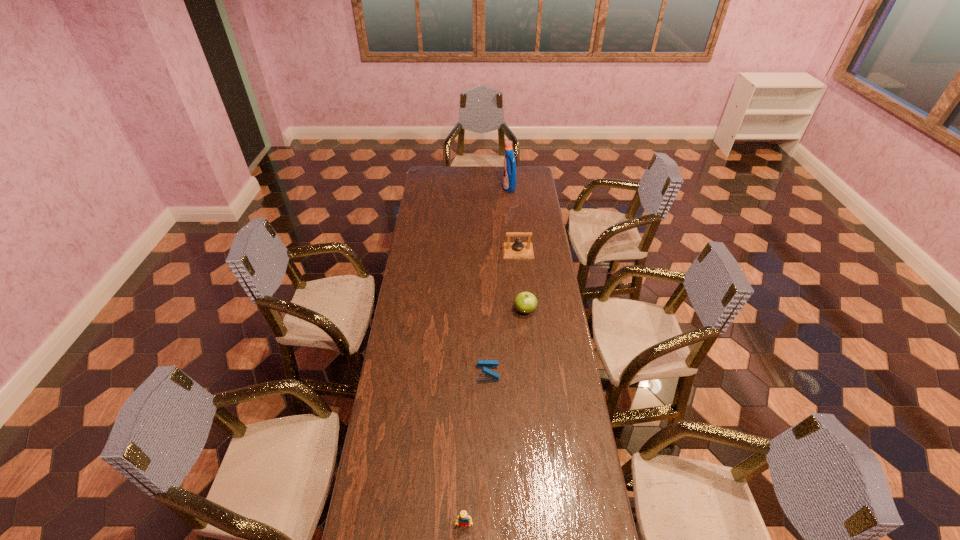
Locate an element on the screen. The width and height of the screenshot is (960, 540). the farthest object is located at coordinates (509, 181).

Find the location of a particular element. detergent is located at coordinates (509, 181).

The height and width of the screenshot is (540, 960). I want to click on the second farthest object, so click(x=518, y=249).

I want to click on the third farthest object, so click(525, 302).

The width and height of the screenshot is (960, 540). I want to click on the nearest object, so click(464, 520).

Identify the location of Lego. The image size is (960, 540). (464, 520).

I want to click on the second object from left to right, so click(x=489, y=375).

At what (x,y) coordinates should I click in order to perform the action: click on the second nearest object. Please return your answer as a coordinate pair (x, y). This screenshot has width=960, height=540. Looking at the image, I should click on (489, 375).

This screenshot has height=540, width=960. Identify the location of vacant point located 0.180m on the label of the tallest object. (473, 188).

Identify the location of vacant region located on the label of the tallest object. The image size is (960, 540). (485, 188).